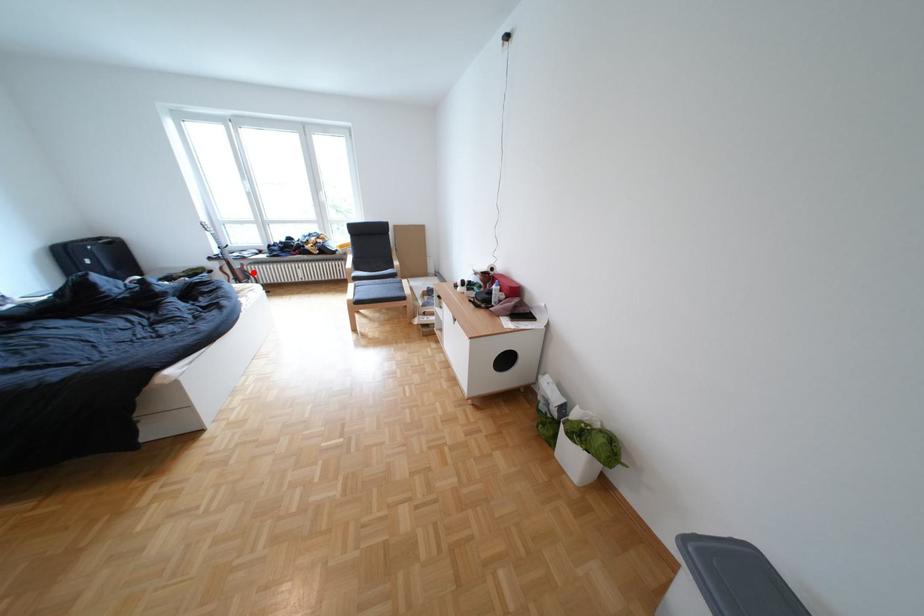
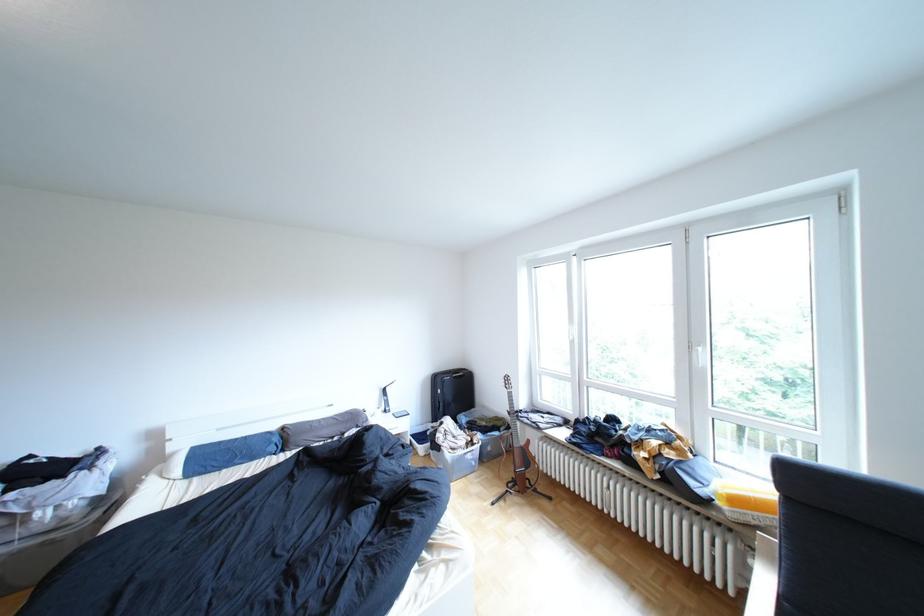
Question: I am providing you with two images of the same scene from different viewpoints. In image1, a red point is highlighted. Considering the same 3D point in image2, which of the following is correct?

Choices:
 (A) It is closer
 (B) It is farther

Answer: (B)